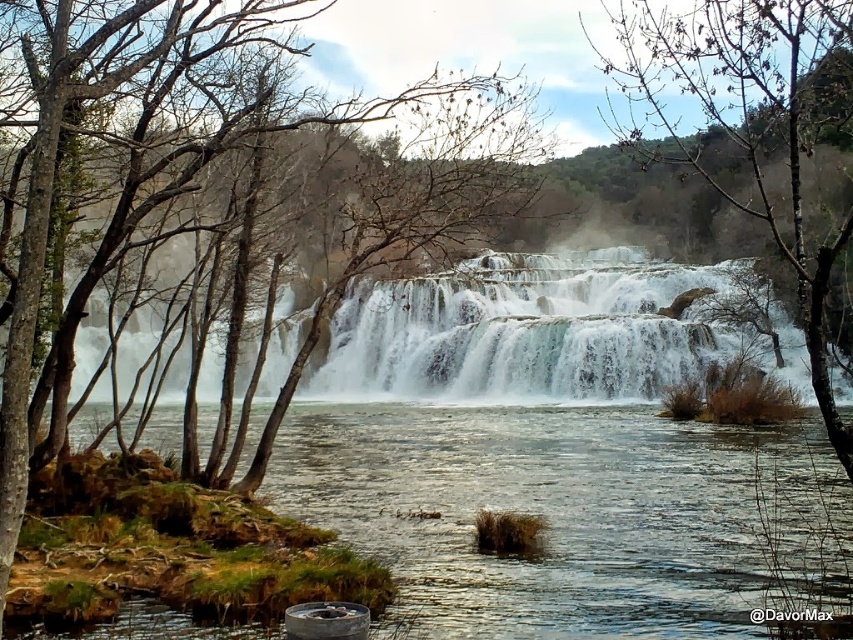
Which is more to the right, clear water at center or white frothy water at center?

From the viewer's perspective, white frothy water at center appears more on the right side.

Between clear water at center and white frothy water at center, which one is positioned higher?

white frothy water at center

What do you see at coordinates (561, 513) in the screenshot? I see `clear water at center` at bounding box center [561, 513].

Locate an element on the screen. This screenshot has width=853, height=640. clear water at center is located at coordinates (561, 513).

Is clear water at center thinner than bare branches at center?

No, clear water at center is not thinner than bare branches at center.

Is point (676, 636) closer to viewer compared to point (706, 106)?

That is True.

This screenshot has height=640, width=853. What are the coordinates of `clear water at center` in the screenshot? It's located at (561, 513).

Can you confirm if bare branches at center is positioned to the left of brown bark tree at left?

Incorrect, bare branches at center is not on the left side of brown bark tree at left.

Is bare branches at center shorter than brown bark tree at left?

In fact, bare branches at center may be taller than brown bark tree at left.

Which is in front, point (822, 384) or point (24, 545)?

Point (822, 384) is in front.

The image size is (853, 640). Identify the location of bare branches at center. (746, 124).